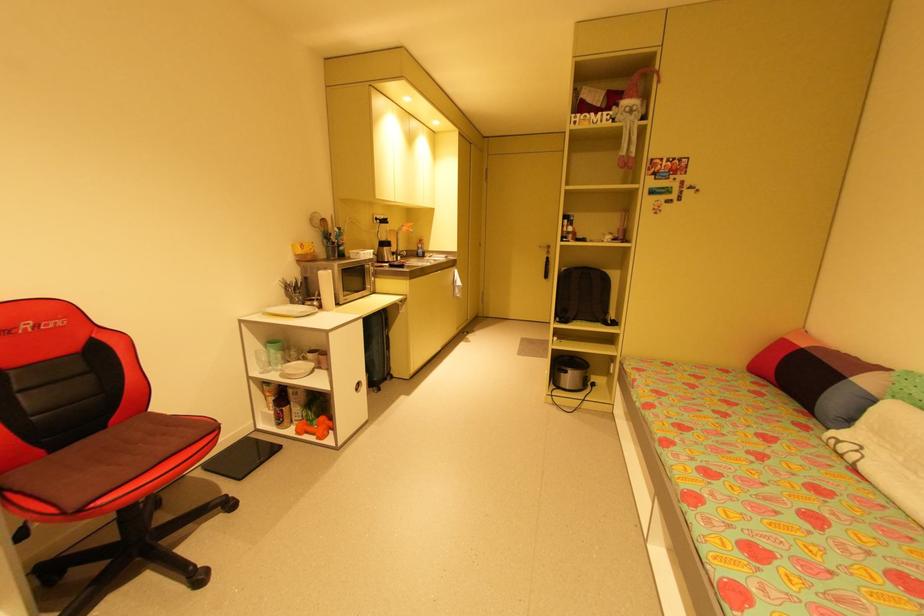
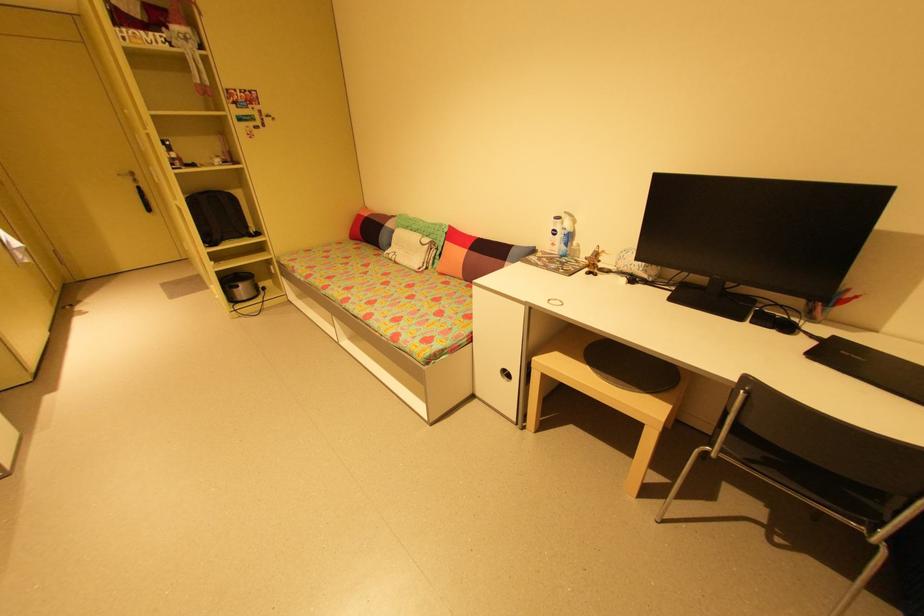
The point at (566, 374) is marked in the first image. Where is the corresponding point in the second image?

(239, 291)